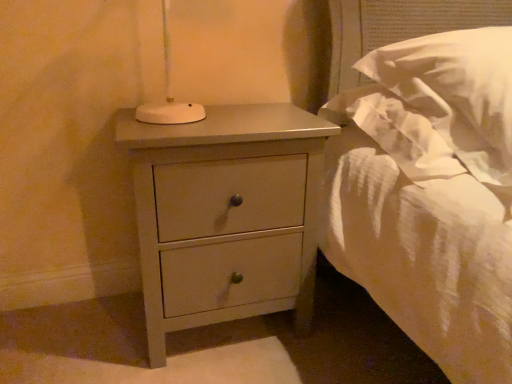
At what (x,y) coordinates should I click in order to perform the action: click on vacant point above matte gray nightstand at lower left (from a real-world perspective). Please return your answer as a coordinate pair (x, y). This screenshot has width=512, height=384. Looking at the image, I should click on 239,117.